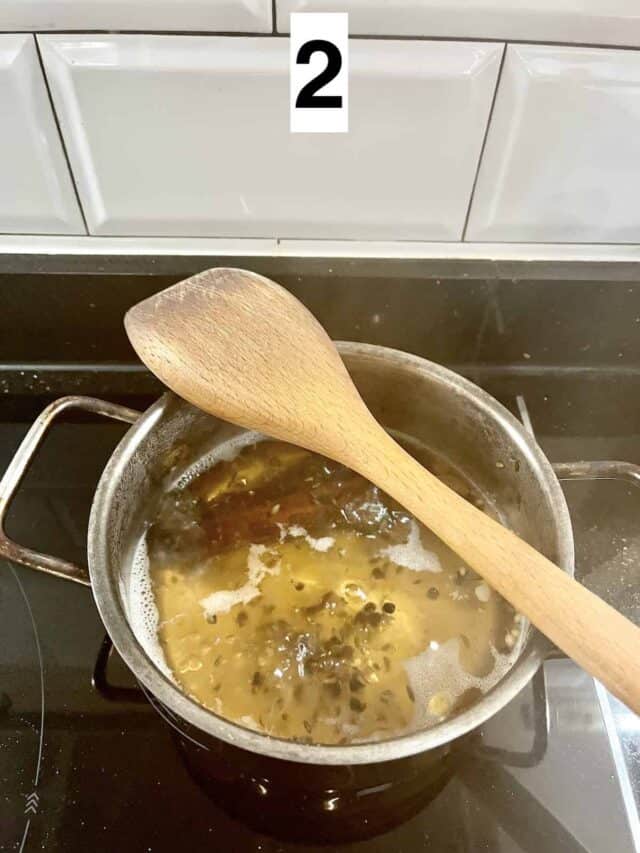
At what (x,y) coordinates should I click in order to perform the action: click on background, white subway title. Please return your answer as a coordinate pair (x, y). Looking at the image, I should click on (516, 19).